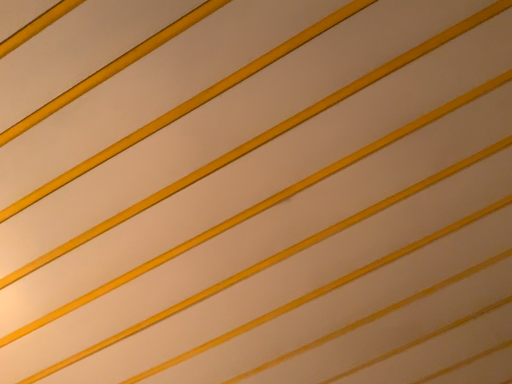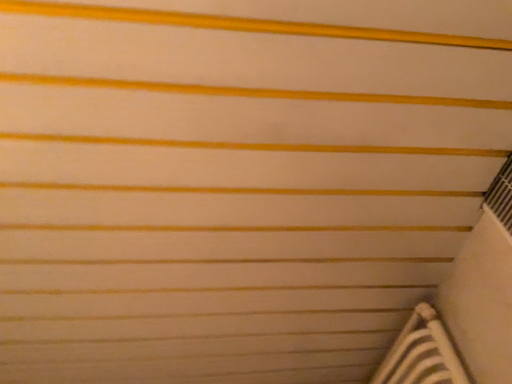
Question: How did the camera likely rotate when shooting the video?

Choices:
 (A) rotated left
 (B) rotated right

Answer: (B)